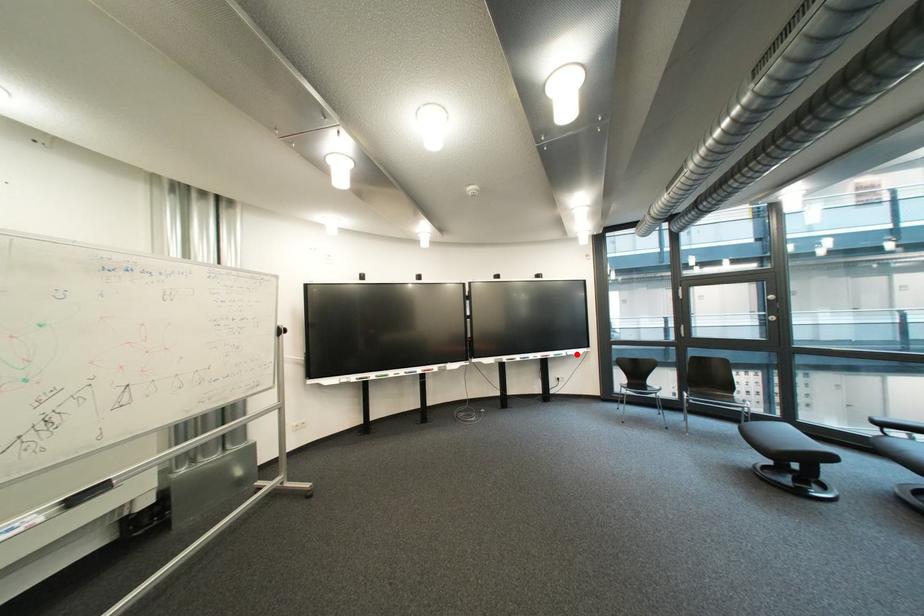
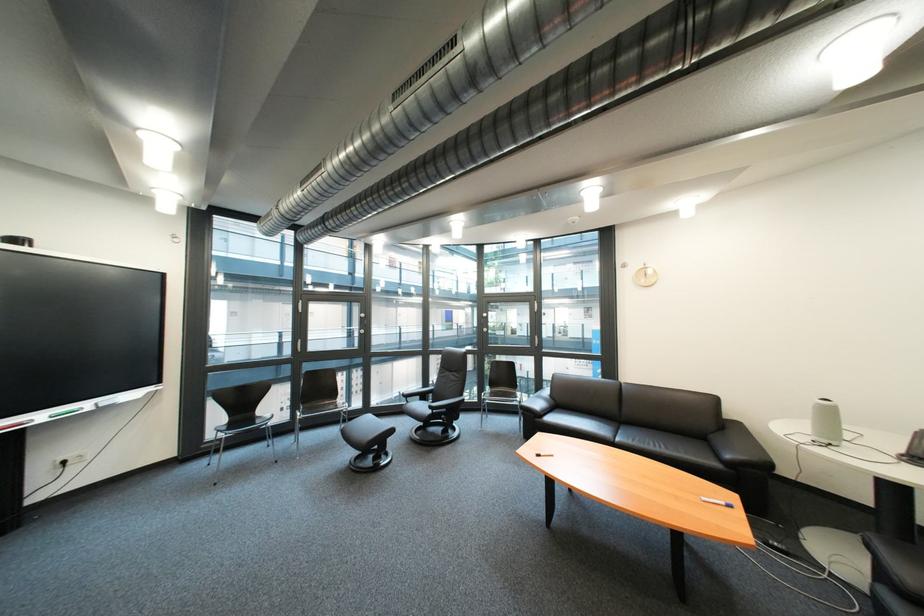
Where in the second image is the point corresponding to the highlighted location from the first image?

(101, 406)